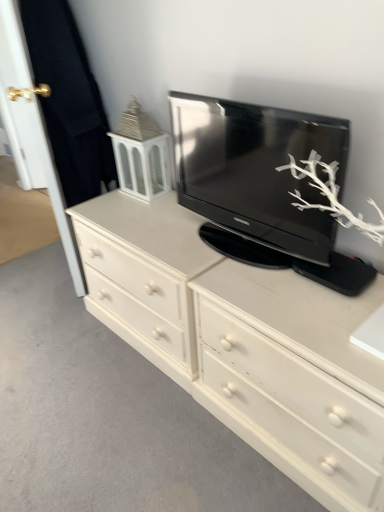
Question: Is white painted wood tv cabinet at upper left placed right next to white matte drawer at center?

Choices:
 (A) yes
 (B) no

Answer: (B)

Question: Is white painted wood tv cabinet at upper left not near white matte drawer at center?

Choices:
 (A) yes
 (B) no

Answer: (B)

Question: Is white matte drawer at center located within white painted wood tv cabinet at upper left?

Choices:
 (A) yes
 (B) no

Answer: (B)

Question: Considering the relative sizes of white painted wood tv cabinet at upper left and white matte drawer at center in the image provided, is white painted wood tv cabinet at upper left smaller than white matte drawer at center?

Choices:
 (A) no
 (B) yes

Answer: (B)

Question: From the image's perspective, is white painted wood tv cabinet at upper left under white matte drawer at center?

Choices:
 (A) yes
 (B) no

Answer: (B)

Question: Is white wood door at left, arranged as the second door when viewed from the left, wider or thinner than gold metallic door handle at upper left, the first door when ordered from left to right?

Choices:
 (A) thin
 (B) wide

Answer: (B)

Question: Do you think white wood door at left, which is counted as the first door, starting from the right, is within gold metallic door handle at upper left, which is counted as the second door, starting from the right, or outside of it?

Choices:
 (A) inside
 (B) outside

Answer: (B)

Question: Looking at the image, does white wood door at left, which is counted as the first door, starting from the right, seem bigger or smaller compared to gold metallic door handle at upper left, the first door when ordered from left to right?

Choices:
 (A) big
 (B) small

Answer: (A)

Question: Considering the relative positions of white wood door at left, arranged as the second door when viewed from the left, and gold metallic door handle at upper left, the first door when ordered from left to right, in the image provided, is white wood door at left, arranged as the second door when viewed from the left, to the left or to the right of gold metallic door handle at upper left, the first door when ordered from left to right,?

Choices:
 (A) left
 (B) right

Answer: (B)

Question: In terms of height, does gold metallic door handle at upper left, which is counted as the second door, starting from the right, look taller or shorter compared to white painted wood chest of drawers at center?

Choices:
 (A) tall
 (B) short

Answer: (A)

Question: From the image's perspective, relative to white painted wood chest of drawers at center, is gold metallic door handle at upper left, which is counted as the second door, starting from the right, above or below?

Choices:
 (A) above
 (B) below

Answer: (A)

Question: From a real-world perspective, relative to white painted wood chest of drawers at center, is gold metallic door handle at upper left, which is counted as the second door, starting from the right, vertically above or below?

Choices:
 (A) below
 (B) above

Answer: (B)

Question: Considering their positions, is gold metallic door handle at upper left, which is counted as the second door, starting from the right, located in front of or behind white painted wood chest of drawers at center?

Choices:
 (A) front
 (B) behind

Answer: (B)

Question: From the image's perspective, relative to white matte drawer at center, is white painted wood tv cabinet at upper left above or below?

Choices:
 (A) below
 (B) above

Answer: (B)

Question: Would you say white painted wood tv cabinet at upper left is inside or outside white matte drawer at center?

Choices:
 (A) inside
 (B) outside

Answer: (B)